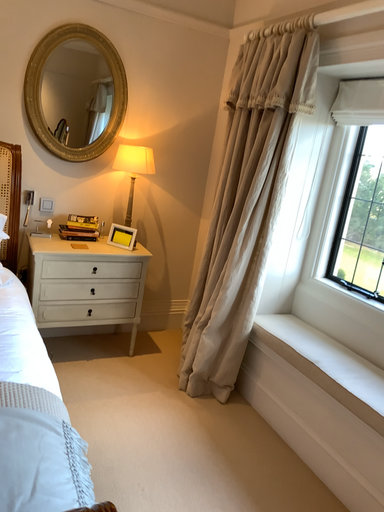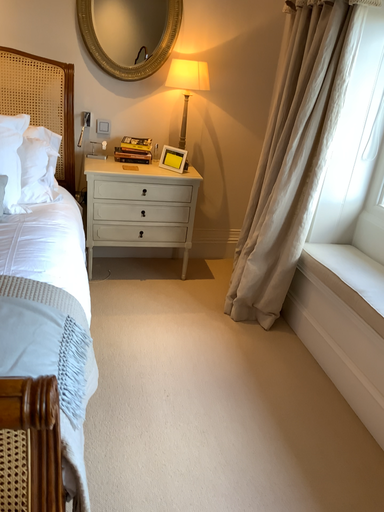
Question: Which way did the camera rotate in the video?

Choices:
 (A) rotated right
 (B) rotated left

Answer: (B)